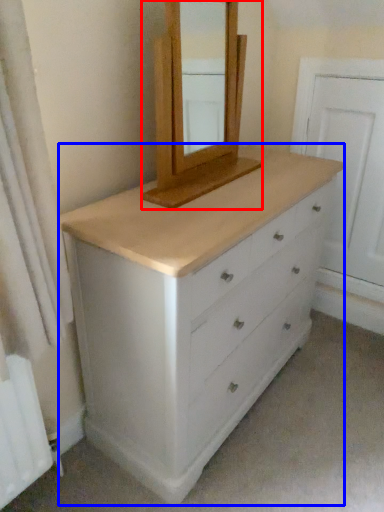
Question: Which point is closer to the camera, medicine cabinet (highlighted by a red box) or chest of drawers (highlighted by a blue box)?

Choices:
 (A) medicine cabinet
 (B) chest of drawers

Answer: (B)